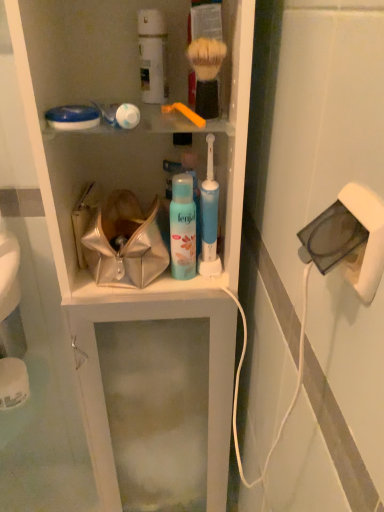
Question: Is white plastic cabinet at center to the left of white matte canister at upper center, which appears as the 1th toiletry when viewed from the left, from the viewer's perspective?

Choices:
 (A) no
 (B) yes

Answer: (B)

Question: Is white plastic cabinet at center not close to white matte canister at upper center, positioned as the first toiletry in top-to-bottom order?

Choices:
 (A) no
 (B) yes

Answer: (A)

Question: Considering the relative sizes of white plastic cabinet at center and white matte canister at upper center, which is counted as the second toiletry, starting from the bottom, in the image provided, is white plastic cabinet at center bigger than white matte canister at upper center, which is counted as the second toiletry, starting from the bottom,?

Choices:
 (A) yes
 (B) no

Answer: (A)

Question: Considering the relative sizes of white plastic cabinet at center and white matte canister at upper center, which is counted as the second toiletry, starting from the bottom, in the image provided, is white plastic cabinet at center taller than white matte canister at upper center, which is counted as the second toiletry, starting from the bottom,?

Choices:
 (A) yes
 (B) no

Answer: (A)

Question: Could you tell me if white plastic cabinet at center is turned towards white matte canister at upper center, positioned as the first toiletry in top-to-bottom order?

Choices:
 (A) no
 (B) yes

Answer: (A)

Question: Is point (112, 224) closer or farther from the camera than point (201, 209)?

Choices:
 (A) farther
 (B) closer

Answer: (A)

Question: From a real-world perspective, relative to blue plastic toothbrush at center, which is counted as the 2th toiletry, starting from the left, is metallic shiny handbag at center vertically above or below?

Choices:
 (A) below
 (B) above

Answer: (A)

Question: Is metallic shiny handbag at center bigger or smaller than blue plastic toothbrush at center, the first toiletry when ordered from bottom to top?

Choices:
 (A) small
 (B) big

Answer: (B)

Question: Would you say metallic shiny handbag at center is to the left or to the right of blue plastic toothbrush at center, arranged as the 1th toiletry when viewed from the right, in the picture?

Choices:
 (A) right
 (B) left

Answer: (B)

Question: Do you think metallic shiny handbag at center is within white matte canister at upper center, which appears as the 1th toiletry when viewed from the left, or outside of it?

Choices:
 (A) outside
 (B) inside

Answer: (A)

Question: Considering the positions of metallic shiny handbag at center and white matte canister at upper center, positioned as the first toiletry in top-to-bottom order, in the image, is metallic shiny handbag at center bigger or smaller than white matte canister at upper center, positioned as the first toiletry in top-to-bottom order,?

Choices:
 (A) big
 (B) small

Answer: (A)

Question: From a real-world perspective, is metallic shiny handbag at center above or below white matte canister at upper center, which is counted as the second toiletry, starting from the bottom?

Choices:
 (A) above
 (B) below

Answer: (B)

Question: Looking at their shapes, would you say metallic shiny handbag at center is wider or thinner than white matte canister at upper center, which appears as the 1th toiletry when viewed from the left?

Choices:
 (A) thin
 (B) wide

Answer: (B)

Question: Which is correct: white matte canister at upper center, which is counted as the second toiletry, starting from the bottom, is inside soft bristle shaving brush at upper center, which is the 1th brush from right to left, or outside of it?

Choices:
 (A) inside
 (B) outside

Answer: (B)

Question: Based on their positions, is white matte canister at upper center, which is counted as the second toiletry, starting from the bottom, located to the left or right of soft bristle shaving brush at upper center, marked as the second brush in a left-to-right arrangement?

Choices:
 (A) right
 (B) left

Answer: (B)